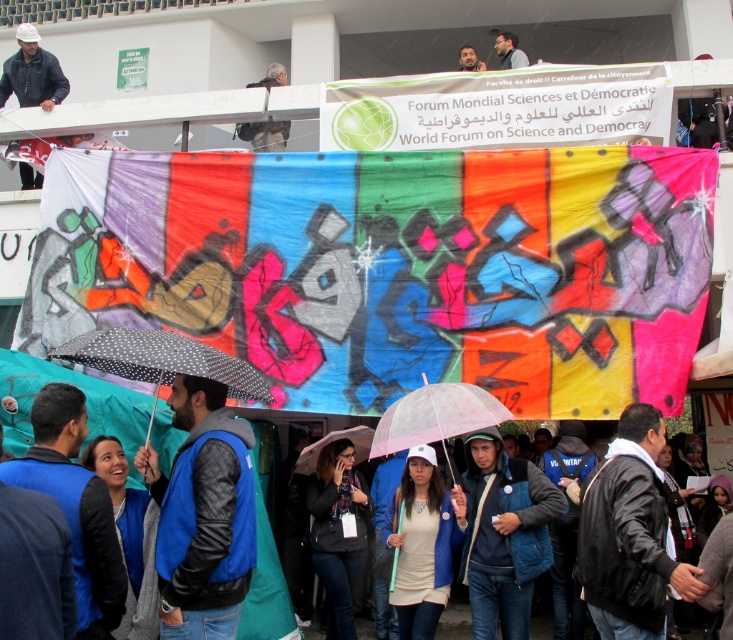
Question: Is the position of white matte baseball cap at center less distant than that of matte black shirt at upper center?

Choices:
 (A) yes
 (B) no

Answer: (A)

Question: Among these objects, which one is nearest to the camera?

Choices:
 (A) polka dot fabric umbrella at center
 (B) matte black camera at upper center
 (C) blue denim jacket at center
 (D) white matte baseball cap at center

Answer: (A)

Question: Which point is closer to the camera taking this photo?

Choices:
 (A) (259, 390)
 (B) (320, 502)
 (C) (372, 428)

Answer: (A)

Question: From the image, what is the correct spatial relationship of polka dot fabric umbrella at center in relation to matte black shirt at upper center?

Choices:
 (A) left
 (B) right

Answer: (A)

Question: Where is graffiti banner at center located in relation to blue denim jacket at center in the image?

Choices:
 (A) right
 (B) left

Answer: (B)

Question: Which of the following is the closest to the observer?

Choices:
 (A) black matte jacket at center
 (B) black leather jacket at lower right

Answer: (B)